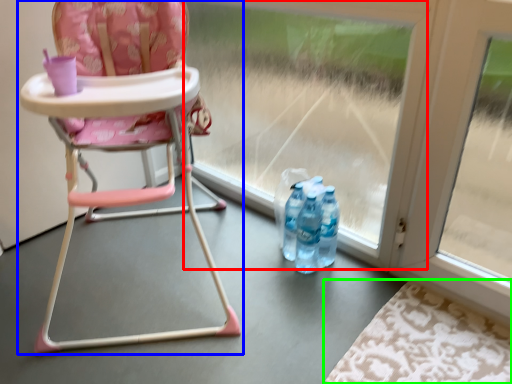
Question: Based on their relative distances, which object is nearer to glass door (highlighted by a red box)? Choose from chair (highlighted by a blue box) and mat (highlighted by a green box).

Choices:
 (A) chair
 (B) mat

Answer: (A)